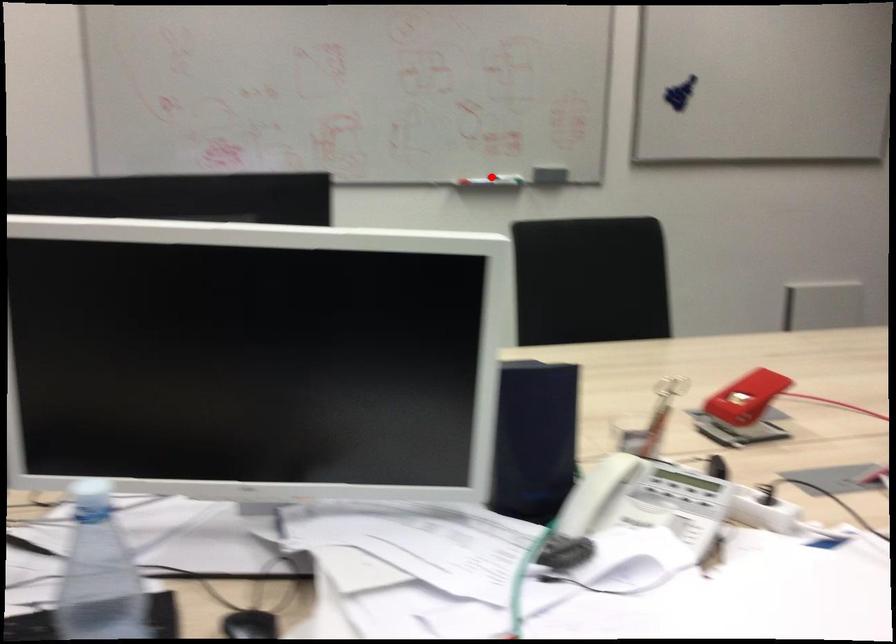
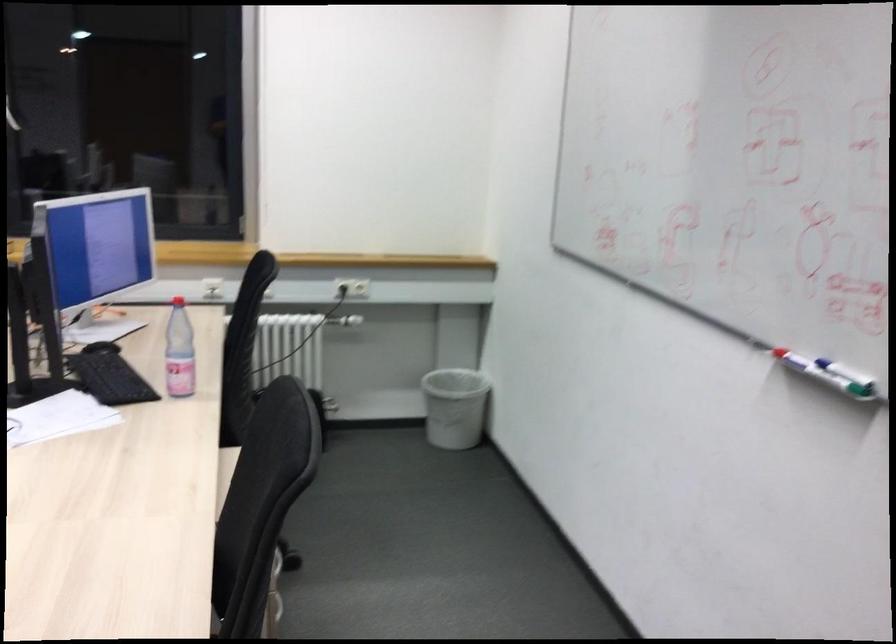
Question: I am providing you with two images of the same scene from different viewpoints. A red point is shown in image1. For the corresponding object point in image2, is it positioned nearer or farther from the camera?

Choices:
 (A) Nearer
 (B) Farther

Answer: (A)